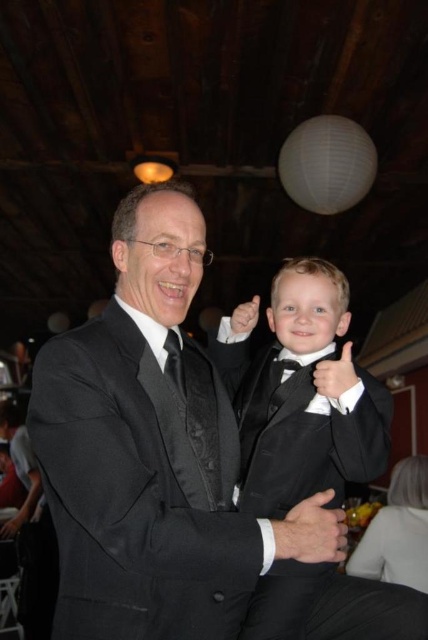
You are standing at the point with coordinates point [184,387] and want to walk to the point with coordinates point [315,490]. According to the image, is the destination point behind or in front of your current position?

The point [315,490] is behind point [184,387], so the destination point is behind your current position.

Where is the black satin tuxedo at center located in the image?

The black satin tuxedo at center is located at point [302,394].

In the image, there is a man in a black suit and a boy in a black suit. Where is the point located at coordinates (195, 404)?

The point at coordinates (195, 404) is on the black satin tie at center.